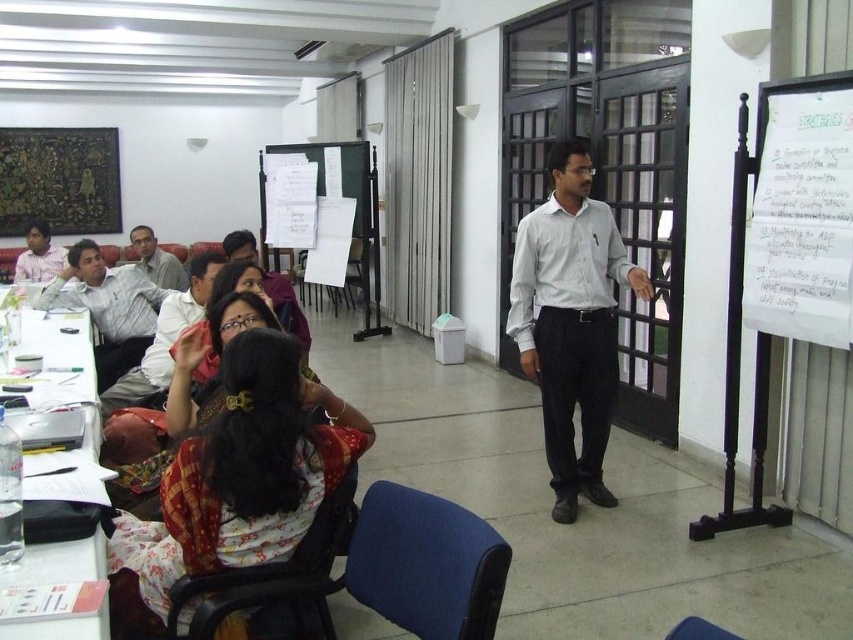
Question: Is white striped shirt at center positioned behind matte gray shirt at upper left?

Choices:
 (A) yes
 (B) no

Answer: (B)

Question: Which point is closer to the camera?

Choices:
 (A) matte gray shirt at upper left
 (B) white paper at upper right

Answer: (B)

Question: Does white paper at upper right come in front of white plastic table at left?

Choices:
 (A) yes
 (B) no

Answer: (B)

Question: Which point appears closest to the camera in this image?

Choices:
 (A) (57, 272)
 (B) (67, 285)
 (C) (140, 250)
 (D) (802, 88)

Answer: (D)

Question: Can you confirm if white paper at upper right is positioned to the left of matte pink shirt at upper left?

Choices:
 (A) no
 (B) yes

Answer: (A)

Question: Among these points, which one is farthest from the camera?

Choices:
 (A) (135, 228)
 (B) (165, 330)
 (C) (798, 173)
 (D) (7, 369)

Answer: (A)